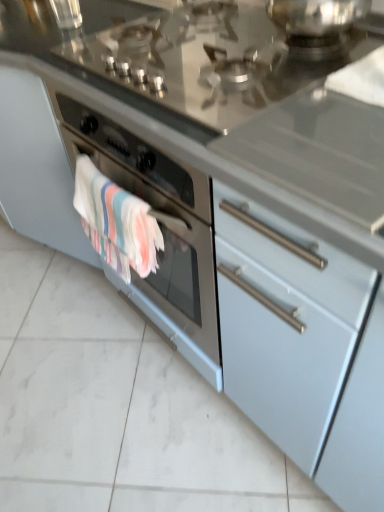
In order to face multicolored woven towel at lower left, should I rotate leftwards or rightwards?

Rotate your view left by about 11.435°.

What do you see at coordinates (116, 222) in the screenshot? The image size is (384, 512). I see `multicolored woven towel at lower left` at bounding box center [116, 222].

Identify the location of multicolored woven towel at lower left. The height and width of the screenshot is (512, 384). (116, 222).

What is the approximate height of multicolored woven towel at lower left?

multicolored woven towel at lower left is 12.57 inches tall.

What is the approximate width of glossy stainless steel stovetop at upper center?

22.01 inches.

Describe the element at coordinates (199, 53) in the screenshot. I see `glossy stainless steel stovetop at upper center` at that location.

Where is `glossy stainless steel stovetop at upper center`? Image resolution: width=384 pixels, height=512 pixels. glossy stainless steel stovetop at upper center is located at coordinates (199, 53).

The width and height of the screenshot is (384, 512). I want to click on multicolored woven towel at lower left, so click(x=116, y=222).

Is multicolored woven towel at lower left at the right side of glossy stainless steel stovetop at upper center?

In fact, multicolored woven towel at lower left is to the left of glossy stainless steel stovetop at upper center.

Who is more distant, multicolored woven towel at lower left or glossy stainless steel stovetop at upper center?

multicolored woven towel at lower left is behind.

Considering the points (98, 227) and (344, 38), which point is behind, point (98, 227) or point (344, 38)?

Positioned behind is point (98, 227).

From the image's perspective, is multicolored woven towel at lower left on glossy stainless steel stovetop at upper center?

No, from the image's perspective, multicolored woven towel at lower left is not above glossy stainless steel stovetop at upper center.

From a real-world perspective, who is located lower, multicolored woven towel at lower left or glossy stainless steel stovetop at upper center?

From a 3D spatial view, multicolored woven towel at lower left is below.

Does multicolored woven towel at lower left have a lesser width compared to glossy stainless steel stovetop at upper center?

Correct, the width of multicolored woven towel at lower left is less than that of glossy stainless steel stovetop at upper center.

Is multicolored woven towel at lower left taller or shorter than glossy stainless steel stovetop at upper center?

Clearly, multicolored woven towel at lower left is taller compared to glossy stainless steel stovetop at upper center.

Considering the sizes of objects multicolored woven towel at lower left and glossy stainless steel stovetop at upper center in the image provided, who is smaller, multicolored woven towel at lower left or glossy stainless steel stovetop at upper center?

Smaller between the two is multicolored woven towel at lower left.

Is glossy stainless steel stovetop at upper center a part of multicolored woven towel at lower left?

No.

Can you see multicolored woven towel at lower left touching glossy stainless steel stovetop at upper center?

No, multicolored woven towel at lower left is not in contact with glossy stainless steel stovetop at upper center.

Could you tell me if multicolored woven towel at lower left is turned towards glossy stainless steel stovetop at upper center?

No, multicolored woven towel at lower left is not oriented towards glossy stainless steel stovetop at upper center.

Can you tell me how much multicolored woven towel at lower left and glossy stainless steel stovetop at upper center differ in facing direction?

The angle between the facing direction of multicolored woven towel at lower left and the facing direction of glossy stainless steel stovetop at upper center is 0.125 degrees.

In the scene shown: How distant is multicolored woven towel at lower left from glossy stainless steel stovetop at upper center?

The distance of multicolored woven towel at lower left from glossy stainless steel stovetop at upper center is 11.76 inches.

Identify the location of bath towel to the left of glossy stainless steel stovetop at upper center. (116, 222).

Which object is positioned more to the right, glossy stainless steel stovetop at upper center or multicolored woven towel at lower left?

From the viewer's perspective, glossy stainless steel stovetop at upper center appears more on the right side.

Considering their positions, is glossy stainless steel stovetop at upper center located in front of or behind multicolored woven towel at lower left?

glossy stainless steel stovetop at upper center is positioned closer to the viewer than multicolored woven towel at lower left.

Which point is more forward, (x=342, y=61) or (x=145, y=230)?

The point (x=342, y=61) is in front.

From the image's perspective, does glossy stainless steel stovetop at upper center appear higher than multicolored woven towel at lower left?

Yes, from the image's perspective, glossy stainless steel stovetop at upper center is above multicolored woven towel at lower left.

From a real-world perspective, which is physically below, glossy stainless steel stovetop at upper center or multicolored woven towel at lower left?

multicolored woven towel at lower left.

Considering the sizes of objects glossy stainless steel stovetop at upper center and multicolored woven towel at lower left in the image provided, who is thinner, glossy stainless steel stovetop at upper center or multicolored woven towel at lower left?

multicolored woven towel at lower left.

Considering the sizes of glossy stainless steel stovetop at upper center and multicolored woven towel at lower left in the image, is glossy stainless steel stovetop at upper center taller or shorter than multicolored woven towel at lower left?

glossy stainless steel stovetop at upper center is shorter than multicolored woven towel at lower left.

Is glossy stainless steel stovetop at upper center bigger than multicolored woven towel at lower left?

Correct, glossy stainless steel stovetop at upper center is larger in size than multicolored woven towel at lower left.

Is glossy stainless steel stovetop at upper center surrounding multicolored woven towel at lower left?

No, multicolored woven towel at lower left is not inside glossy stainless steel stovetop at upper center.

Is glossy stainless steel stovetop at upper center next to multicolored woven towel at lower left?

They are not placed beside each other.

Looking at this image, is glossy stainless steel stovetop at upper center positioned with its back to multicolored woven towel at lower left?

glossy stainless steel stovetop at upper center is not turned away from multicolored woven towel at lower left.

Where is `countertop in front of the multicolored woven towel at lower left`? This screenshot has height=512, width=384. countertop in front of the multicolored woven towel at lower left is located at coordinates (199, 53).

Image resolution: width=384 pixels, height=512 pixels. I want to click on countertop located on the right of multicolored woven towel at lower left, so click(199, 53).

The height and width of the screenshot is (512, 384). Find the location of `bath towel that is on the left side of glossy stainless steel stovetop at upper center`. bath towel that is on the left side of glossy stainless steel stovetop at upper center is located at coordinates (116, 222).